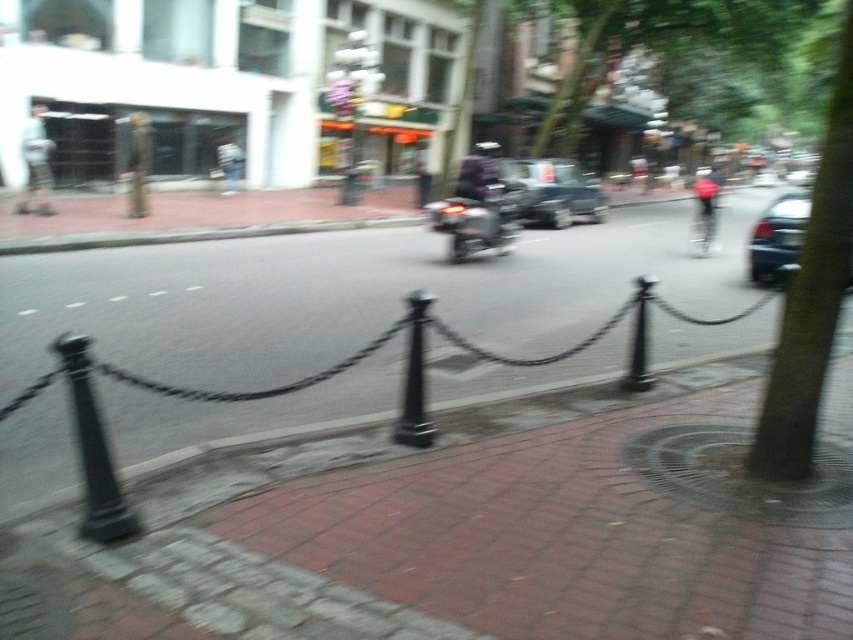
Question: Which point is farther from the camera taking this photo?

Choices:
 (A) (56, 339)
 (B) (421, 388)

Answer: (A)

Question: Is shiny black car at right wider than black metal pole at center?

Choices:
 (A) no
 (B) yes

Answer: (B)

Question: Where is brick pavement at center located in relation to green leafy tree at right in the image?

Choices:
 (A) right
 (B) left

Answer: (B)

Question: Observing the image, what is the correct spatial positioning of green leafy tree at right in reference to metallic silver car at center?

Choices:
 (A) right
 (B) left

Answer: (A)

Question: Estimate the real-world distances between objects in this image. Which object is closer to the black metal pole at lower left?

Choices:
 (A) metallic silver car at center
 (B) black metal pole at center
 (C) shiny metallic motorcycle at center
 (D) brick pavement at center

Answer: (B)

Question: Among these objects, which one is nearest to the camera?

Choices:
 (A) brick pavement at center
 (B) green leafy tree at right

Answer: (A)